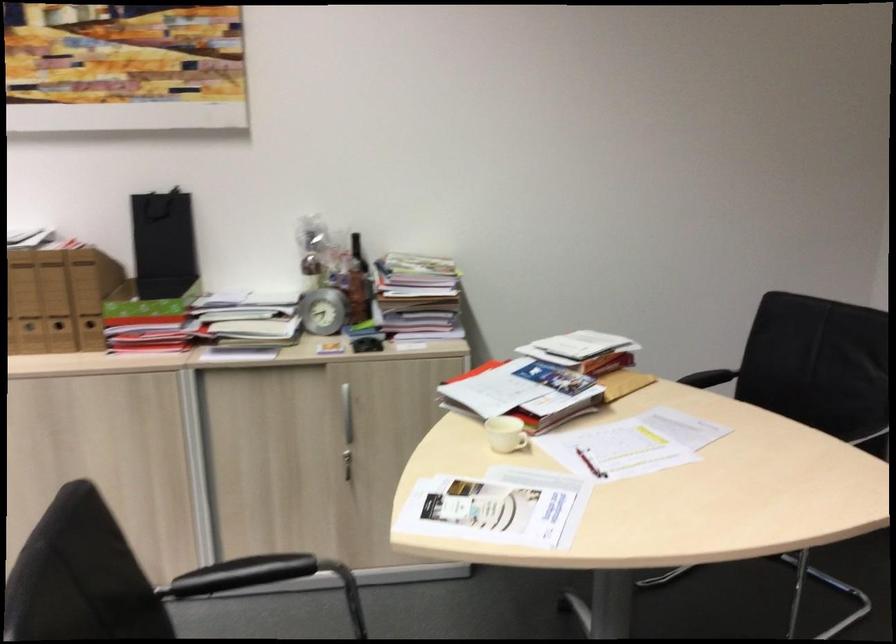
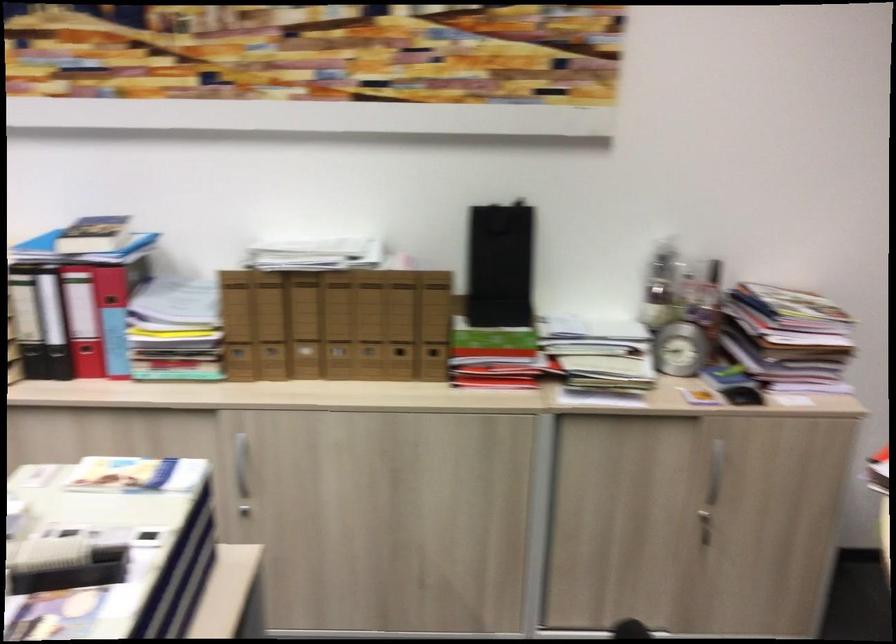
Question: Which direction would the cameraman need to move to produce the second image? Reply with the corresponding letter.

Choices:
 (A) Left
 (B) Right
 (C) Forward
 (D) Backward

Answer: (A)